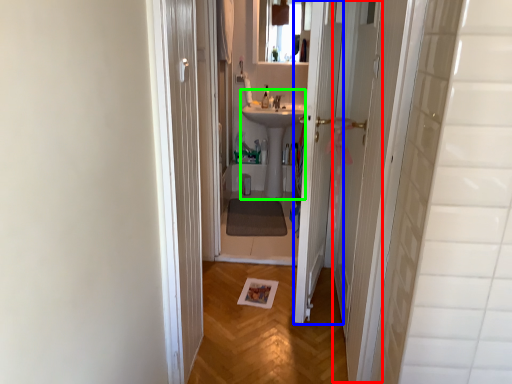
Question: Which object is the closest to the screen door (highlighted by a red box)? Choose among these: door (highlighted by a blue box) or sink (highlighted by a green box).

Choices:
 (A) door
 (B) sink

Answer: (A)